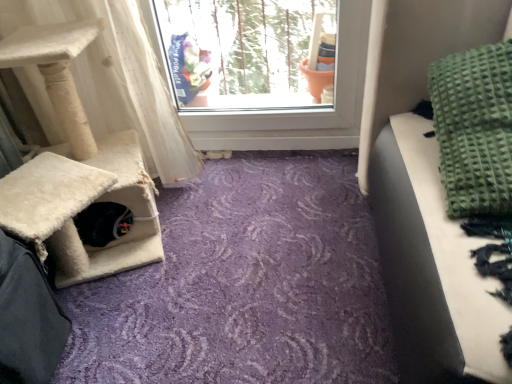
Describe the element at coordinates (118, 79) in the screenshot. I see `white textured curtain at left` at that location.

What are the coordinates of `white textured curtain at left` in the screenshot? It's located at (118, 79).

The height and width of the screenshot is (384, 512). Describe the element at coordinates (474, 129) in the screenshot. I see `green textured blanket at upper right` at that location.

Where is `green textured blanket at upper right`? This screenshot has width=512, height=384. green textured blanket at upper right is located at coordinates (474, 129).

At what (x,y) coordinates should I click in order to perform the action: click on white textured curtain at left. Please return your answer as a coordinate pair (x, y). Looking at the image, I should click on (118, 79).

Between green textured blanket at upper right and white textured curtain at left, which one appears on the left side from the viewer's perspective?

Positioned to the left is white textured curtain at left.

Which object is further away from the camera, green textured blanket at upper right or white textured curtain at left?

white textured curtain at left.

Does point (496, 49) come closer to viewer compared to point (56, 22)?

Yes.

From the image's perspective, is green textured blanket at upper right on white textured curtain at left?

Yes, from the image's perspective, green textured blanket at upper right is on top of white textured curtain at left.

From a real-world perspective, is green textured blanket at upper right on top of white textured curtain at left?

Yes, from a real-world perspective, green textured blanket at upper right is on top of white textured curtain at left.

Considering the relative sizes of green textured blanket at upper right and white textured curtain at left in the image provided, is green textured blanket at upper right thinner than white textured curtain at left?

Indeed, green textured blanket at upper right has a lesser width compared to white textured curtain at left.

Considering the relative sizes of green textured blanket at upper right and white textured curtain at left in the image provided, is green textured blanket at upper right shorter than white textured curtain at left?

Indeed, green textured blanket at upper right has a lesser height compared to white textured curtain at left.

Which of these two, green textured blanket at upper right or white textured curtain at left, is smaller?

Smaller between the two is green textured blanket at upper right.

Is green textured blanket at upper right surrounding white textured curtain at left?

No, white textured curtain at left is not inside green textured blanket at upper right.

Is green textured blanket at upper right touching white textured curtain at left?

green textured blanket at upper right and white textured curtain at left are clearly separated.

Is green textured blanket at upper right positioned with its back to white textured curtain at left?

No.

How many degrees apart are the facing directions of green textured blanket at upper right and white textured curtain at left?

They differ by 85.8 degrees in their facing directions.

The image size is (512, 384). I want to click on blanket lying on the right of white textured curtain at left, so coord(474,129).

Between white textured curtain at left and green textured blanket at upper right, which one appears on the left side from the viewer's perspective?

white textured curtain at left is more to the left.

Considering the positions of objects white textured curtain at left and green textured blanket at upper right in the image provided, who is behind, white textured curtain at left or green textured blanket at upper right?

white textured curtain at left is behind.

Considering the positions of point (76, 16) and point (490, 84), is point (76, 16) closer or farther from the camera than point (490, 84)?

Point (76, 16) appears to be farther away from the viewer than point (490, 84).

From the image's perspective, which one is positioned lower, white textured curtain at left or green textured blanket at upper right?

white textured curtain at left, from the image's perspective.

From a real-world perspective, between white textured curtain at left and green textured blanket at upper right, who is vertically higher?

From a 3D spatial view, green textured blanket at upper right is above.

Which of these two, white textured curtain at left or green textured blanket at upper right, is thinner?

Thinner between the two is green textured blanket at upper right.

From their relative heights in the image, would you say white textured curtain at left is taller or shorter than green textured blanket at upper right?

white textured curtain at left is taller than green textured blanket at upper right.

Which of these two, white textured curtain at left or green textured blanket at upper right, is bigger?

With larger size is white textured curtain at left.

In the scene shown: Would you say white textured curtain at left is inside or outside green textured blanket at upper right?

The correct answer is: outside.

Are white textured curtain at left and green textured blanket at upper right far apart?

No, there isn't a large distance between white textured curtain at left and green textured blanket at upper right.

Is white textured curtain at left oriented towards green textured blanket at upper right?

Yes, white textured curtain at left is aimed at green textured blanket at upper right.

Looking at this image, can you tell me how much white textured curtain at left and green textured blanket at upper right differ in facing direction?

There is a 85.8-degree angle between the facing directions of white textured curtain at left and green textured blanket at upper right.

Measure the distance from white textured curtain at left to green textured blanket at upper right.

A distance of 39.34 inches exists between white textured curtain at left and green textured blanket at upper right.

Where is `blanket in front of the white textured curtain at left`? blanket in front of the white textured curtain at left is located at coordinates pos(474,129).

Where is `curtain located behind the green textured blanket at upper right`? curtain located behind the green textured blanket at upper right is located at coordinates click(x=118, y=79).

Locate an element on the screen. This screenshot has height=384, width=512. blanket that appears on the right of white textured curtain at left is located at coordinates (474, 129).